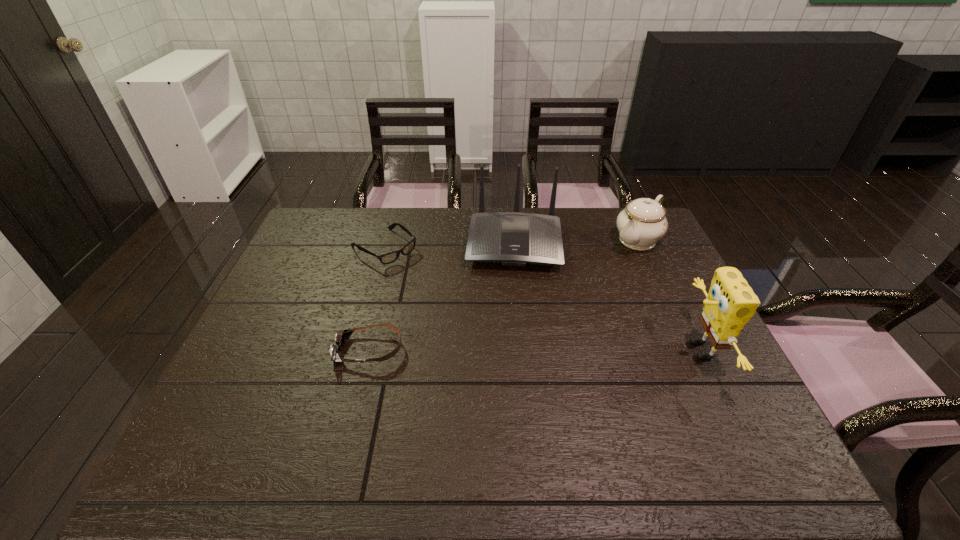
Where is `goggles`? goggles is located at coordinates (341, 338).

At what (x,y) coordinates should I click in order to perform the action: click on sponge. Please return your answer as a coordinate pair (x, y). This screenshot has width=960, height=540. Looking at the image, I should click on (731, 302).

Find the location of `router`. router is located at coordinates (512, 238).

Locate an element on the screen. The height and width of the screenshot is (540, 960). the third tallest object is located at coordinates coord(643,222).

Where is `spectacles`? The height and width of the screenshot is (540, 960). spectacles is located at coordinates (388, 258).

Image resolution: width=960 pixels, height=540 pixels. I want to click on vacant region located 0.220m on the front-facing side of the goggles, so point(250,350).

Image resolution: width=960 pixels, height=540 pixels. I want to click on free space located 0.100m on the front-facing side of the goggles, so (297, 350).

Where is `free space located 0.090m on the front-facing side of the goggles`? The image size is (960, 540). free space located 0.090m on the front-facing side of the goggles is located at coordinates (300, 350).

Locate an element on the screen. vacant space located 0.400m on the face of the sponge is located at coordinates (524, 350).

I want to click on free spot located 0.130m on the face of the sponge, so click(631, 350).